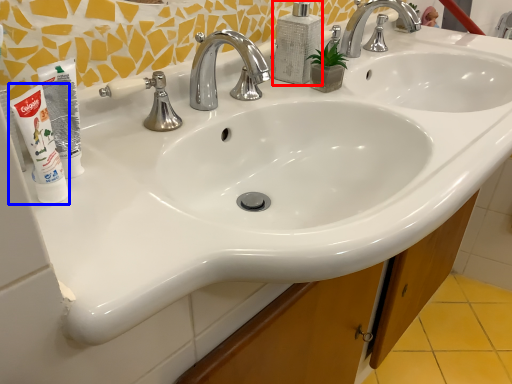
Question: Which point is closer to the camera, soap dispenser (highlighted by a red box) or shaving cream (highlighted by a blue box)?

Choices:
 (A) soap dispenser
 (B) shaving cream

Answer: (B)